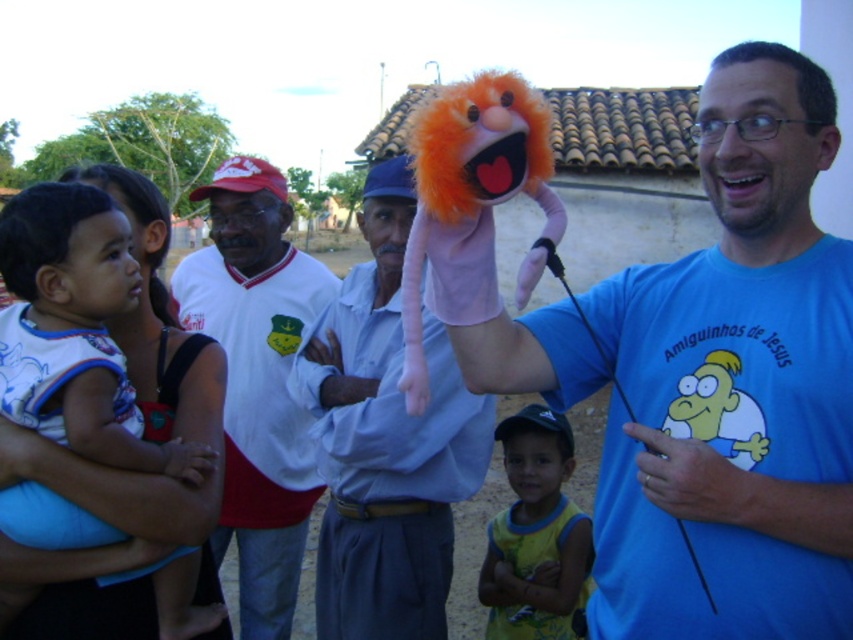
You are a photographer trying to capture a closeup of the orange plush puppet at upper center without the soft blue fabric baby at left blocking the view. Can you move closer to the puppet while keeping both in frame?

The soft blue fabric baby at left is further to the viewer than the orange plush puppet at upper center, so moving closer to the puppet might bring the baby out of frame. To keep both in frame while avoiding obstruction, you might need to adjust your angle instead of moving closer.

In the scene shown: You are a photographer trying to capture a photo of the light blue cotton shirt at center and the white jersey at center. Which one should you focus on first to ensure both are in focus?

You should focus on the light blue cotton shirt at center first because it is closer to the viewer than the white jersey at center, so adjusting focus from near to far will help both be in focus.